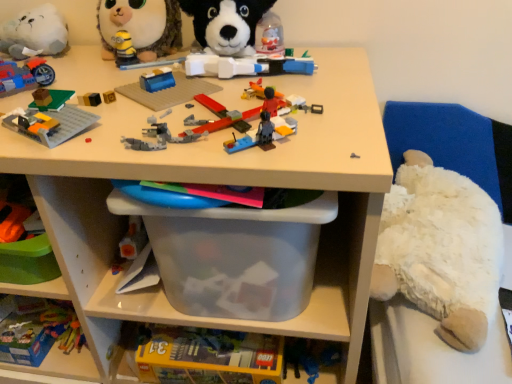
Where is `empty space that is in between translucent plastic airplane at center, which is the 6th toy from left to right, and translucent plastic baseplate at upper left, the fifth toy from the right`? The height and width of the screenshot is (384, 512). empty space that is in between translucent plastic airplane at center, which is the 6th toy from left to right, and translucent plastic baseplate at upper left, the fifth toy from the right is located at coordinates (126, 117).